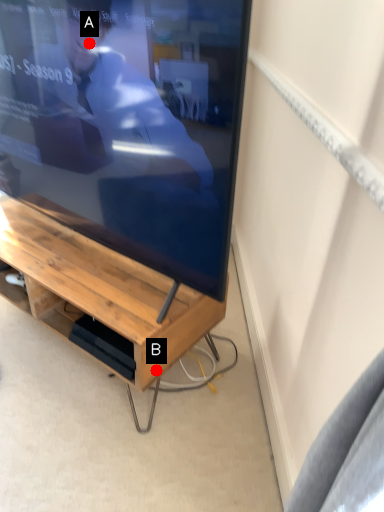
Question: Two points are circled on the image, labeled by A and B beside each circle. Which point is further to the camera?

Choices:
 (A) A is further
 (B) B is further

Answer: (B)